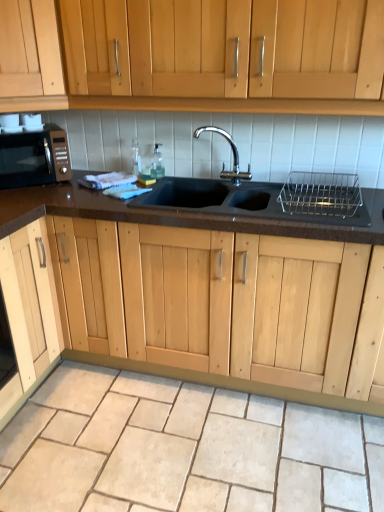
Question: Which direction should I rotate to face clear glass bottle at sink, which is counted as the 1th bottle, starting from the right, — up or down?

Choices:
 (A) down
 (B) up

Answer: (B)

Question: Is metallic silver dish rack at upper right positioned beyond the bounds of light wood cabinet at upper left?

Choices:
 (A) yes
 (B) no

Answer: (A)

Question: Does metallic silver dish rack at upper right come behind light wood cabinet at upper left?

Choices:
 (A) yes
 (B) no

Answer: (B)

Question: Does metallic silver dish rack at upper right touch light wood cabinet at upper left?

Choices:
 (A) no
 (B) yes

Answer: (A)

Question: Is light wood cabinet at upper left completely or partially inside metallic silver dish rack at upper right?

Choices:
 (A) yes
 (B) no

Answer: (B)

Question: Considering the relative sizes of metallic silver dish rack at upper right and light wood cabinet at upper left in the image provided, is metallic silver dish rack at upper right taller than light wood cabinet at upper left?

Choices:
 (A) no
 (B) yes

Answer: (A)

Question: Is metallic silver dish rack at upper right smaller than light wood cabinet at upper left?

Choices:
 (A) no
 (B) yes

Answer: (B)

Question: Does clear glass bottle at sink, which is counted as the 1th bottle, starting from the right, have a smaller size compared to matte black microwave at left?

Choices:
 (A) yes
 (B) no

Answer: (A)

Question: Considering the relative sizes of clear glass bottle at sink, which is the 2th bottle from left to right, and matte black microwave at left in the image provided, is clear glass bottle at sink, which is the 2th bottle from left to right, wider than matte black microwave at left?

Choices:
 (A) no
 (B) yes

Answer: (A)

Question: Could you tell me if clear glass bottle at sink, which is the 2th bottle from left to right, is turned towards matte black microwave at left?

Choices:
 (A) yes
 (B) no

Answer: (B)

Question: Are clear glass bottle at sink, which is counted as the 1th bottle, starting from the right, and matte black microwave at left making contact?

Choices:
 (A) yes
 (B) no

Answer: (B)

Question: From a real-world perspective, is clear glass bottle at sink, which is the 2th bottle from left to right, positioned over matte black microwave at left based on gravity?

Choices:
 (A) no
 (B) yes

Answer: (A)

Question: From the image's perspective, is clear glass bottle at sink, which is counted as the 1th bottle, starting from the right, on top of matte black microwave at left?

Choices:
 (A) yes
 (B) no

Answer: (B)

Question: Can you see metallic silver dish rack at upper right touching beige stone granite at lower center?

Choices:
 (A) no
 (B) yes

Answer: (A)